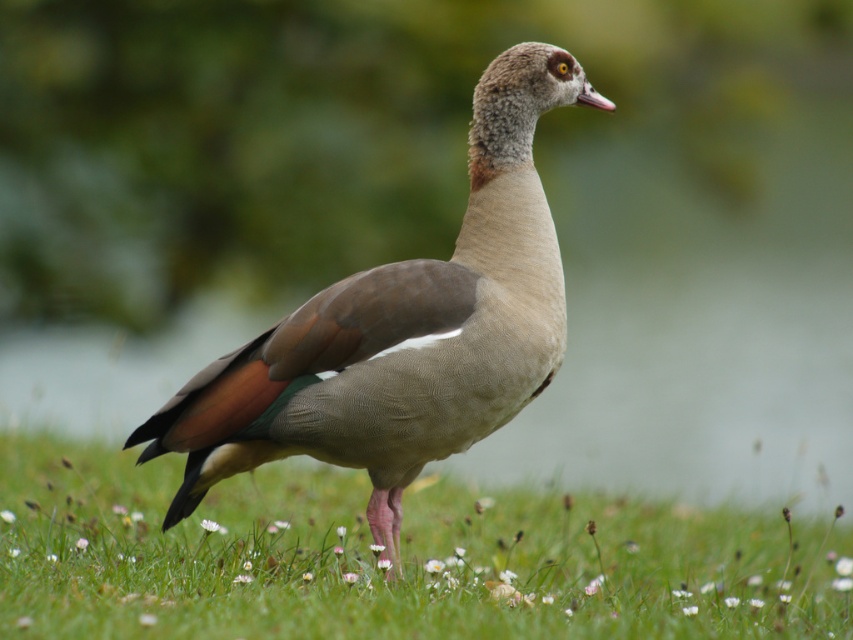
You are a photographer trying to capture the Egyptian Goose in the image. The goose is standing at the point labeled as point (374,560). Since you want to focus on the goose, you decide to blur the background. Which part of the image should you blur?

You should blur the background, which is the green grass at center, as the Egyptian Goose is at the point labeled (374,560).

You are a photographer aiming to capture the Egyptian Goose in the scene. You notice the green grass at center and the brown feathered duck at center. Which object is closer to the camera?

The brown feathered duck at center is closer to the camera because the green grass at center is positioned under it.